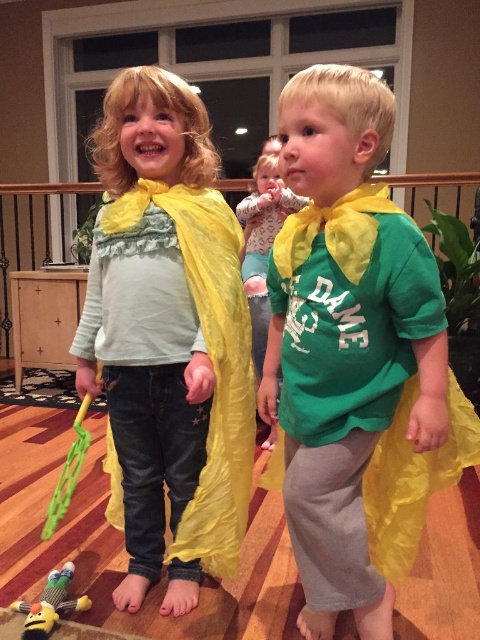
You are a photographer setting up for a superhero photoshoot. You have two points marked in the image that need to be aligned with your camera. The first point is at coordinate point (357, 520) and the second is at point (88, 435). Which point should you focus on first to ensure proper depth of field?

You should focus on point (357, 520) first because it is closer to the camera than point (88, 435), ensuring proper depth of field for that area first.

You are a photographer trying to capture the perfect shot of the two children in the scene. You notice a specific point in the image at coordinates point (x=346, y=337). What object does this point correspond to?

The point (x=346, y=337) corresponds to the matte yellow cape at right.

You are a photographer trying to capture a closeup shot of the child on the left. You have a camera with a fixed focal length and want to focus on the point at point (385, 262). However, you also want to ensure that the point at point (278, 221) is still in focus. Given that the depth of field can only cover objects within 0.1 units from the focal point, will both points be in focus?

Point (385, 262) is closer to the camera than point (278, 221). The distance between them is sqrt